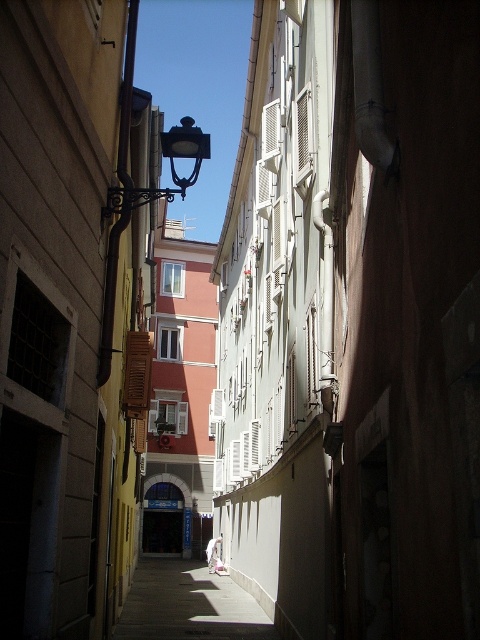
In the scene shown: Can you confirm if smooth concrete sidewalk at center is positioned to the left of polished brass streetlamp at upper center?

Correct, you'll find smooth concrete sidewalk at center to the left of polished brass streetlamp at upper center.

Who is more distant from viewer, (167, 604) or (111, 264)?

The point (167, 604) is more distant.

Describe the element at coordinates (189, 604) in the screenshot. The image size is (480, 640). I see `smooth concrete sidewalk at center` at that location.

This screenshot has width=480, height=640. What are the coordinates of `smooth concrete sidewalk at center` in the screenshot? It's located at (189, 604).